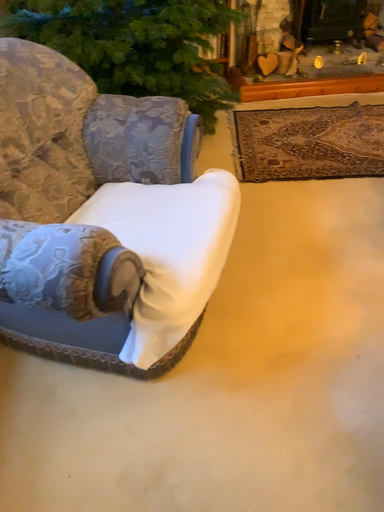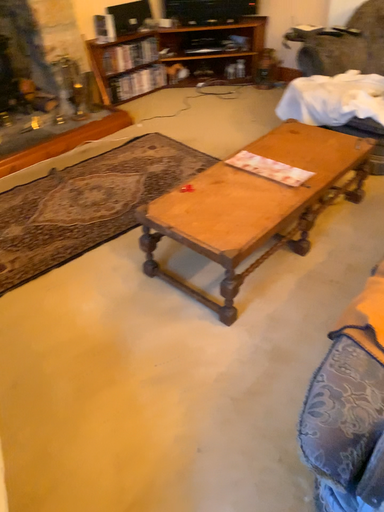
Question: How did the camera likely rotate when shooting the video?

Choices:
 (A) rotated right
 (B) rotated left

Answer: (A)